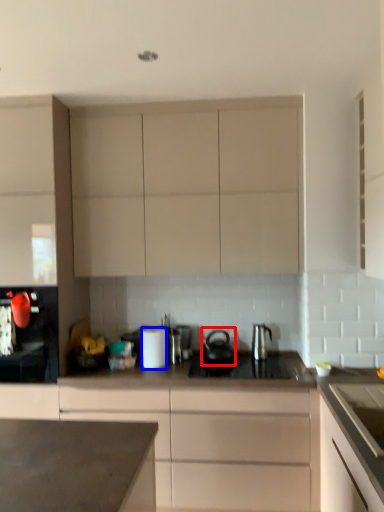
Question: Which of the following is the closest to the observer, tea pot (highlighted by a red box) or kitchen appliance (highlighted by a blue box)?

Choices:
 (A) tea pot
 (B) kitchen appliance

Answer: (B)